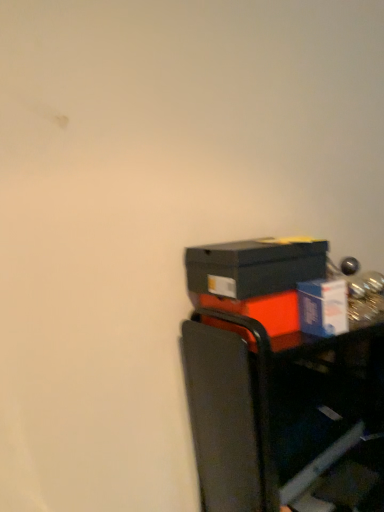
This screenshot has width=384, height=512. What do you see at coordinates (264, 314) in the screenshot?
I see `orange matte box at right, which appears as the first box when ordered from the bottom` at bounding box center [264, 314].

In order to face matte black box at right, which is the third box in bottom-to-top order, should I rotate leftwards or rightwards?

You should look right and rotate roughly 9.016 degrees.

Locate an element on the screen. This screenshot has width=384, height=512. matte black box at right, which is the third box in bottom-to-top order is located at coordinates (254, 266).

This screenshot has width=384, height=512. I want to click on metallic black cart at lower right, so click(x=275, y=408).

In order to face metallic black cart at lower right, should I rotate leftwards or rightwards?

It's best to rotate right around 15.329 degrees.

The width and height of the screenshot is (384, 512). Find the location of `orange matte box at right, which appears as the 3th box when viewed from the top`. orange matte box at right, which appears as the 3th box when viewed from the top is located at coordinates (264, 314).

Consider the image. Is orange matte box at right, which appears as the 3th box when viewed from the top, located outside matte black box at right, which is the third box in bottom-to-top order?

orange matte box at right, which appears as the 3th box when viewed from the top, is positioned outside matte black box at right, which is the third box in bottom-to-top order.

Between orange matte box at right, which appears as the first box when ordered from the bottom, and matte black box at right, which is the third box in bottom-to-top order, which one has more height?

Standing taller between the two is matte black box at right, which is the third box in bottom-to-top order.

In the scene shown: Is orange matte box at right, which appears as the first box when ordered from the bottom, turned away from matte black box at right, which is the third box in bottom-to-top order?

That's not correct — orange matte box at right, which appears as the first box when ordered from the bottom, is not looking away from matte black box at right, which is the third box in bottom-to-top order.

Considering the points (250, 309) and (284, 264), which point is behind, point (250, 309) or point (284, 264)?

The point (284, 264) is farther.

Based on their positions, is matte black box at right, which is the third box in bottom-to-top order, located to the left or right of orange matte box at right, which appears as the 3th box when viewed from the top?

matte black box at right, which is the third box in bottom-to-top order, is positioned on orange matte box at right, which appears as the 3th box when viewed from the top,'s left side.

Consider the image. Would you consider matte black box at right, positioned as the 1th box in top-to-bottom order, to be distant from orange matte box at right, which appears as the 3th box when viewed from the top?

No.

Relative to orange matte box at right, which appears as the 3th box when viewed from the top, is matte black box at right, which is the third box in bottom-to-top order, in front or behind?

Visually, matte black box at right, which is the third box in bottom-to-top order, is located in front of orange matte box at right, which appears as the 3th box when viewed from the top.

Is the surface of blue cardboard box at right, arranged as the 2th box when ordered from the bottom, in direct contact with matte black box at right, positioned as the 1th box in top-to-bottom order?

blue cardboard box at right, arranged as the 2th box when ordered from the bottom, and matte black box at right, positioned as the 1th box in top-to-bottom order, are not in contact.

Does blue cardboard box at right, which is counted as the 2th box, starting from the top, lie behind matte black box at right, which is the third box in bottom-to-top order?

Yes, the depth of blue cardboard box at right, which is counted as the 2th box, starting from the top, is greater than that of matte black box at right, which is the third box in bottom-to-top order.

From the image's perspective, which is below, blue cardboard box at right, arranged as the 2th box when ordered from the bottom, or matte black box at right, which is the third box in bottom-to-top order?

blue cardboard box at right, arranged as the 2th box when ordered from the bottom.

Is blue cardboard box at right, arranged as the 2th box when ordered from the bottom, aimed at matte black box at right, which is the third box in bottom-to-top order?

No.

Considering the positions of objects matte black box at right, positioned as the 1th box in top-to-bottom order, and blue cardboard box at right, arranged as the 2th box when ordered from the bottom, in the image provided, who is more to the right, matte black box at right, positioned as the 1th box in top-to-bottom order, or blue cardboard box at right, arranged as the 2th box when ordered from the bottom,?

Positioned to the right is blue cardboard box at right, arranged as the 2th box when ordered from the bottom.

Considering the positions of objects matte black box at right, which is the third box in bottom-to-top order, and blue cardboard box at right, arranged as the 2th box when ordered from the bottom, in the image provided, who is in front, matte black box at right, which is the third box in bottom-to-top order, or blue cardboard box at right, arranged as the 2th box when ordered from the bottom,?

matte black box at right, which is the third box in bottom-to-top order, is in front.

Considering the relative sizes of matte black box at right, positioned as the 1th box in top-to-bottom order, and blue cardboard box at right, arranged as the 2th box when ordered from the bottom, in the image provided, is matte black box at right, positioned as the 1th box in top-to-bottom order, bigger than blue cardboard box at right, arranged as the 2th box when ordered from the bottom,?

Yes.

Would you say matte black box at right, which is the third box in bottom-to-top order, contains blue cardboard box at right, which is counted as the 2th box, starting from the top?

No, blue cardboard box at right, which is counted as the 2th box, starting from the top, is not inside matte black box at right, which is the third box in bottom-to-top order.

Identify the location of furniture in front of the orange matte box at right, which appears as the 3th box when viewed from the top. (275, 408).

Consider the image. How much distance is there between metallic black cart at lower right and orange matte box at right, which appears as the first box when ordered from the bottom?

11.13 inches.

Are metallic black cart at lower right and orange matte box at right, which appears as the first box when ordered from the bottom, located far from each other?

No, metallic black cart at lower right is not far from orange matte box at right, which appears as the first box when ordered from the bottom.

How different are the orientations of metallic black cart at lower right and orange matte box at right, which appears as the first box when ordered from the bottom, in degrees?

14.3 degrees.

Is blue cardboard box at right, which is counted as the 2th box, starting from the top, to the left of orange matte box at right, which appears as the 3th box when viewed from the top, from the viewer's perspective?

Incorrect, blue cardboard box at right, which is counted as the 2th box, starting from the top, is not on the left side of orange matte box at right, which appears as the 3th box when viewed from the top.

Is blue cardboard box at right, arranged as the 2th box when ordered from the bottom, bigger or smaller than orange matte box at right, which appears as the 3th box when viewed from the top?

Considering their sizes, blue cardboard box at right, arranged as the 2th box when ordered from the bottom, takes up less space than orange matte box at right, which appears as the 3th box when viewed from the top.

Is blue cardboard box at right, which is counted as the 2th box, starting from the top, positioned beyond the bounds of orange matte box at right, which appears as the 3th box when viewed from the top?

Yes.

From a real-world perspective, is blue cardboard box at right, which is counted as the 2th box, starting from the top, below orange matte box at right, which appears as the first box when ordered from the bottom?

No, from a real-world perspective, blue cardboard box at right, which is counted as the 2th box, starting from the top, is not below orange matte box at right, which appears as the first box when ordered from the bottom.

From the image's perspective, which is below, metallic black cart at lower right or matte black box at right, which is the third box in bottom-to-top order?

From the image's view, metallic black cart at lower right is below.

The image size is (384, 512). I want to click on furniture beneath the matte black box at right, which is the third box in bottom-to-top order (from a real-world perspective), so coord(275,408).

How different are the orientations of metallic black cart at lower right and matte black box at right, which is the third box in bottom-to-top order, in degrees?

The angle between the facing direction of metallic black cart at lower right and the facing direction of matte black box at right, which is the third box in bottom-to-top order, is 11.8 degrees.

Is metallic black cart at lower right positioned with its back to matte black box at right, which is the third box in bottom-to-top order?

metallic black cart at lower right is not turned away from matte black box at right, which is the third box in bottom-to-top order.

Find the location of a particular element. This screenshot has height=512, width=384. box that is the 2nd object located below the matte black box at right, which is the third box in bottom-to-top order (from the image's perspective) is located at coordinates (264, 314).

There is a orange matte box at right, which appears as the 3th box when viewed from the top. Where is `the 2nd box above it (from a real-world perspective)`? The image size is (384, 512). the 2nd box above it (from a real-world perspective) is located at coordinates (254, 266).

Looking at the image, which one is located closer to metallic black cart at lower right, blue cardboard box at right, arranged as the 2th box when ordered from the bottom, or orange matte box at right, which appears as the first box when ordered from the bottom?

orange matte box at right, which appears as the first box when ordered from the bottom, is closer to metallic black cart at lower right.

Estimate the real-world distances between objects in this image. Which object is closer to orange matte box at right, which appears as the first box when ordered from the bottom, matte black box at right, positioned as the 1th box in top-to-bottom order, or metallic black cart at lower right?

matte black box at right, positioned as the 1th box in top-to-bottom order, lies closer to orange matte box at right, which appears as the first box when ordered from the bottom, than the other object.

Looking at the image, which one is located further to metallic black cart at lower right, orange matte box at right, which appears as the 3th box when viewed from the top, or blue cardboard box at right, arranged as the 2th box when ordered from the bottom?

The object further to metallic black cart at lower right is blue cardboard box at right, arranged as the 2th box when ordered from the bottom.

Estimate the real-world distances between objects in this image. Which object is further from orange matte box at right, which appears as the 3th box when viewed from the top, metallic black cart at lower right or matte black box at right, positioned as the 1th box in top-to-bottom order?

Among the two, metallic black cart at lower right is located further to orange matte box at right, which appears as the 3th box when viewed from the top.

Based on their spatial positions, is blue cardboard box at right, which is counted as the 2th box, starting from the top, or metallic black cart at lower right closer to matte black box at right, positioned as the 1th box in top-to-bottom order?

Based on the image, blue cardboard box at right, which is counted as the 2th box, starting from the top, appears to be nearer to matte black box at right, positioned as the 1th box in top-to-bottom order.

From the image, which object appears to be farther from metallic black cart at lower right, blue cardboard box at right, arranged as the 2th box when ordered from the bottom, or matte black box at right, which is the third box in bottom-to-top order?

Based on the image, blue cardboard box at right, arranged as the 2th box when ordered from the bottom, appears to be further to metallic black cart at lower right.

From the image, which object appears to be nearer to orange matte box at right, which appears as the first box when ordered from the bottom, blue cardboard box at right, which is counted as the 2th box, starting from the top, or matte black box at right, positioned as the 1th box in top-to-bottom order?

matte black box at right, positioned as the 1th box in top-to-bottom order, is positioned closer to the anchor orange matte box at right, which appears as the first box when ordered from the bottom.

From the image, which object appears to be nearer to matte black box at right, which is the third box in bottom-to-top order, orange matte box at right, which appears as the 3th box when viewed from the top, or blue cardboard box at right, arranged as the 2th box when ordered from the bottom?

orange matte box at right, which appears as the 3th box when viewed from the top.

The image size is (384, 512). In order to click on box between blue cardboard box at right, which is counted as the 2th box, starting from the top, and metallic black cart at lower right vertically in this screenshot , I will do `click(264, 314)`.

You are a GUI agent. You are given a task and a screenshot of the screen. Output one action in this format:
    pyautogui.click(x=<x>, y=<y>)
    Task: Click on the box between matte black box at right, positioned as the 1th box in top-to-bottom order, and blue cardboard box at right, which is counted as the 2th box, starting from the top
    The height and width of the screenshot is (512, 384).
    Given the screenshot: What is the action you would take?
    pyautogui.click(x=264, y=314)